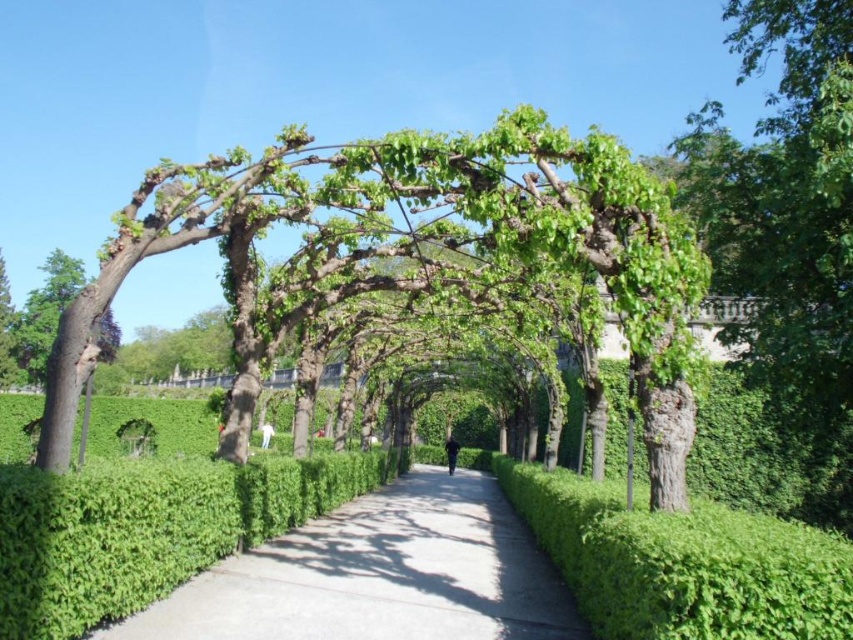
Does green leafy tree at center have a larger size compared to green concrete pavement at center?

Yes.

Does green leafy tree at center have a greater height compared to green concrete pavement at center?

Yes, green leafy tree at center is taller than green concrete pavement at center.

You are a GUI agent. You are given a task and a screenshot of the screen. Output one action in this format:
    pyautogui.click(x=<x>, y=<y>)
    Task: Click on the green leafy tree at center
    
    Given the screenshot: What is the action you would take?
    pyautogui.click(x=419, y=253)

Between green concrete pavement at center and smooth brown tree trunk at left, which one is positioned higher?

smooth brown tree trunk at left is higher up.

Does point (265, 545) come closer to viewer compared to point (28, 305)?

Yes.

You are a GUI agent. You are given a task and a screenshot of the screen. Output one action in this format:
    pyautogui.click(x=<x>, y=<y>)
    Task: Click on the green concrete pavement at center
    Image resolution: width=853 pixels, height=640 pixels.
    Given the screenshot: What is the action you would take?
    pyautogui.click(x=379, y=576)

Consider the image. Is green leafy tree at center further to the viewer compared to smooth brown tree trunk at left?

No, green leafy tree at center is closer to the viewer.

Which of these two, green leafy tree at center or smooth brown tree trunk at left, stands taller?

smooth brown tree trunk at left

This screenshot has width=853, height=640. What do you see at coordinates (419, 253) in the screenshot? I see `green leafy tree at center` at bounding box center [419, 253].

At what (x,y) coordinates should I click in order to perform the action: click on green leafy tree at center. Please return your answer as a coordinate pair (x, y). Looking at the image, I should click on (419, 253).